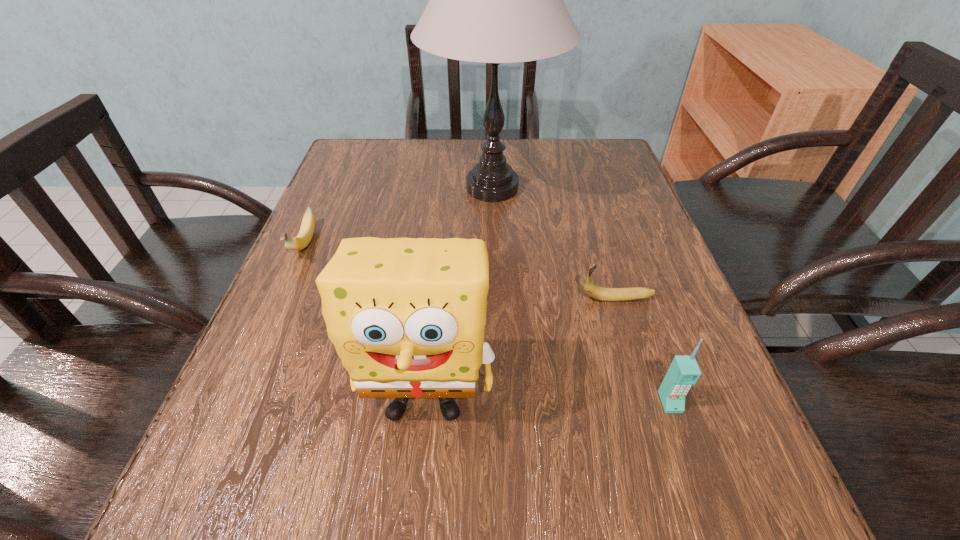
Image resolution: width=960 pixels, height=540 pixels. Find the location of `the tallest object`. the tallest object is located at coordinates (494, 0).

Find the location of a particular element. This screenshot has width=960, height=540. the second tallest object is located at coordinates (407, 316).

The image size is (960, 540). Identify the location of the third tallest object. [x=684, y=371].

Where is `the third farthest object`? Image resolution: width=960 pixels, height=540 pixels. the third farthest object is located at coordinates coord(599,293).

Locate an element on the screen. Image resolution: width=960 pixels, height=540 pixels. the nearer banana is located at coordinates pos(599,293).

Where is `the left banana`? This screenshot has width=960, height=540. the left banana is located at coordinates (301, 241).

Where is `the leftmost object`? the leftmost object is located at coordinates (301, 241).

Identify the location of free space located on the left of the tallest object. (325, 188).

Find the location of a particular element. The width and height of the screenshot is (960, 540). vacant space located on the face of the sponge is located at coordinates (416, 497).

Where is `vacant space located on the keypad of the cellular telephone`? vacant space located on the keypad of the cellular telephone is located at coordinates (693, 470).